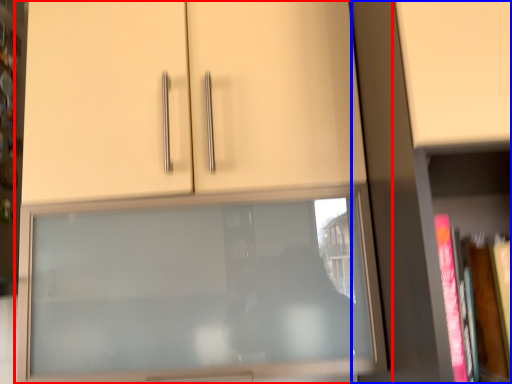
Question: Among these objects, which one is nearest to the camera, cupboard (highlighted by a red box) or bookcase (highlighted by a blue box)?

Choices:
 (A) cupboard
 (B) bookcase

Answer: (B)